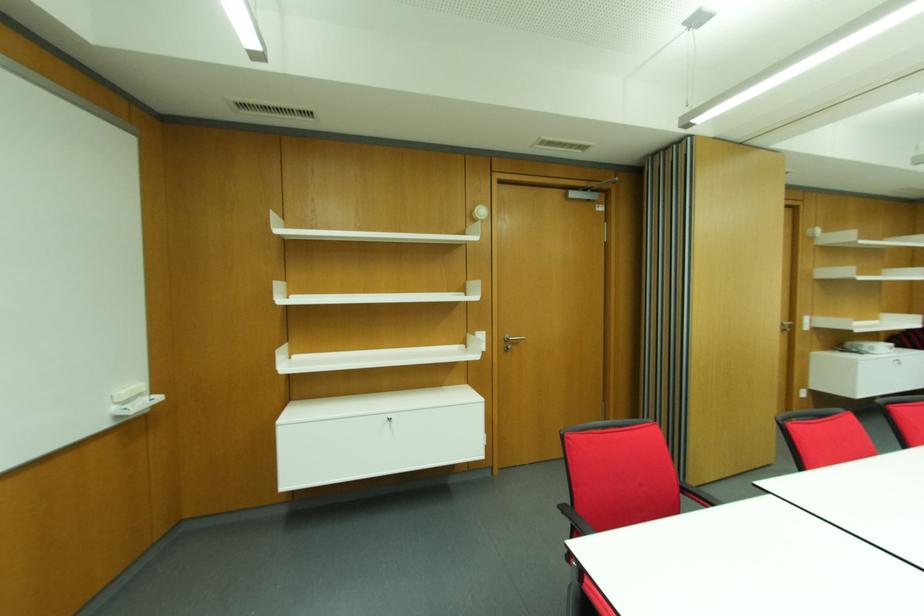
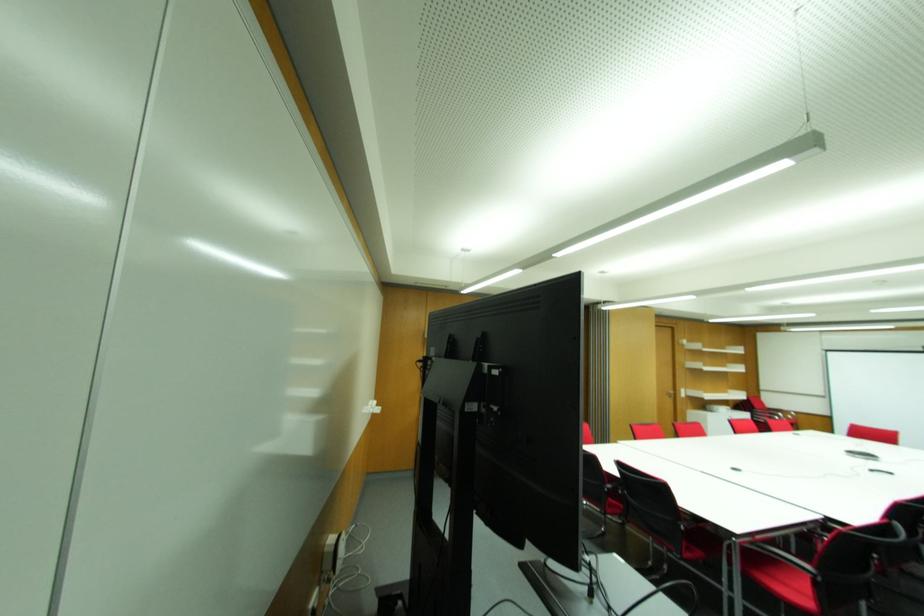
Find the pixel in the second image that matches (791,326) in the first image.

(675, 394)